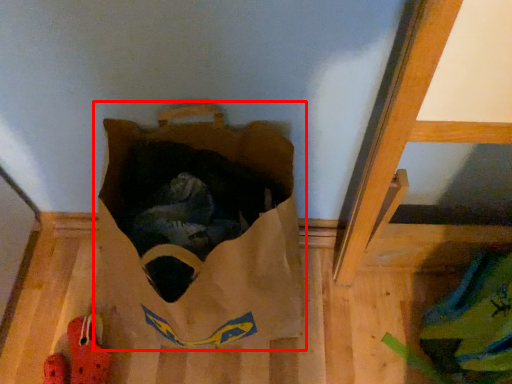
Question: From the image's perspective, where is grocery bag (annotated by the red box) located in relation to footwear in the image?

Choices:
 (A) above
 (B) below

Answer: (A)